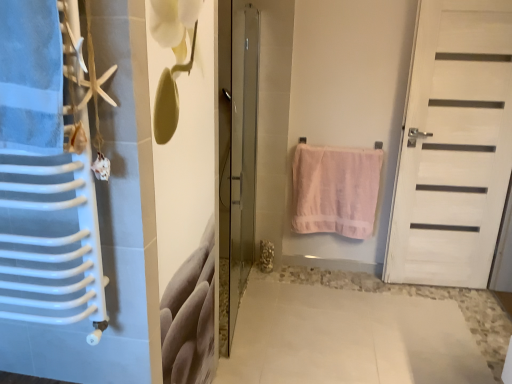
Where is `vacant space underneath white matte door at right, which appears as the 2th door when viewed from the left (from a real-world perspective)`? The height and width of the screenshot is (384, 512). vacant space underneath white matte door at right, which appears as the 2th door when viewed from the left (from a real-world perspective) is located at coordinates (436, 286).